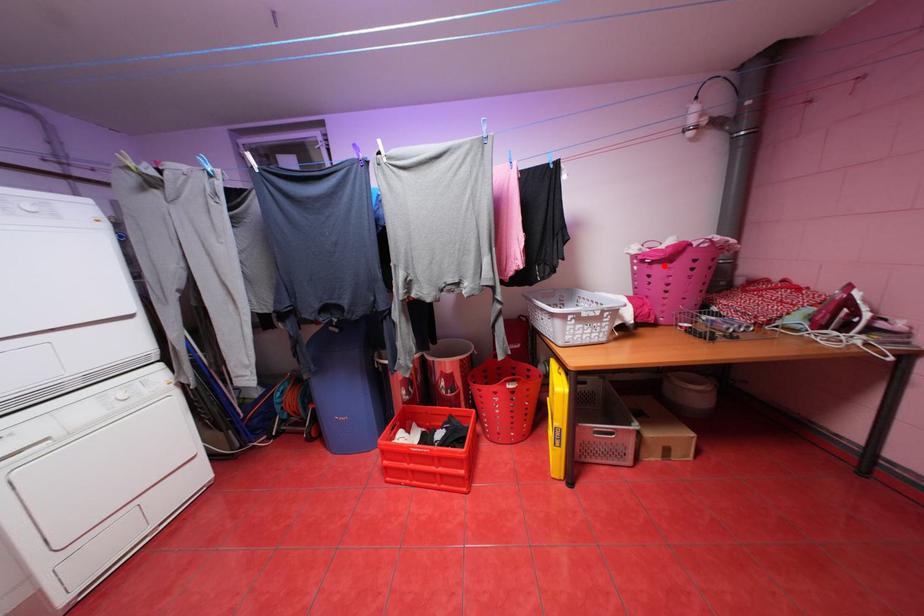
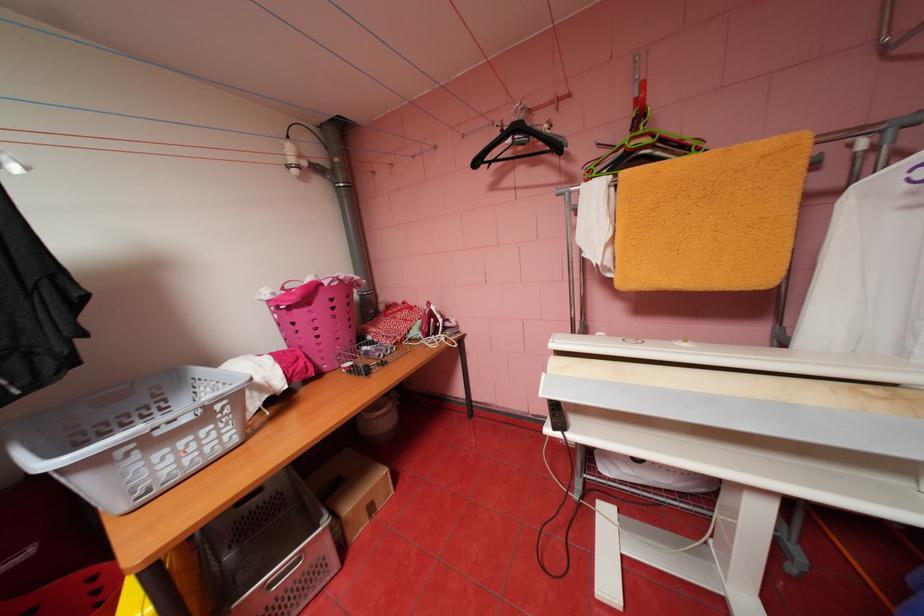
Where in the second image is the point corresponding to the highlighted location from the first image?

(304, 310)